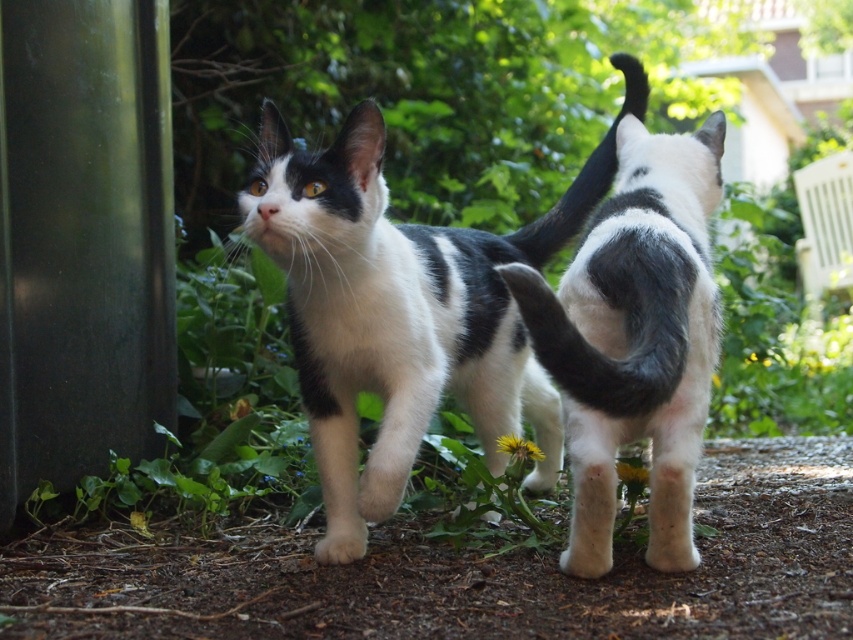
Question: Which of these objects is positioned closest to the black fur tail at upper center?

Choices:
 (A) black and white fur cat at center
 (B) black soft fur tail at center
 (C) black-and-white fur cat at center

Answer: (C)

Question: Does black-and-white fur cat at center appear on the right side of black fur tail at upper center?

Choices:
 (A) yes
 (B) no

Answer: (B)

Question: Which point is farther to the camera?

Choices:
 (A) (538, 240)
 (B) (714, 189)
 (C) (672, 339)
 (D) (352, 161)

Answer: (A)

Question: Among these points, which one is farthest from the camera?

Choices:
 (A) (527, 248)
 (B) (556, 241)
 (C) (648, 148)
 (D) (683, 253)

Answer: (B)

Question: Where is black soft fur tail at center located in relation to black fur tail at upper center in the image?

Choices:
 (A) left
 (B) right

Answer: (A)

Question: Does black and white fur cat at center have a greater width compared to black fur tail at upper center?

Choices:
 (A) yes
 (B) no

Answer: (A)